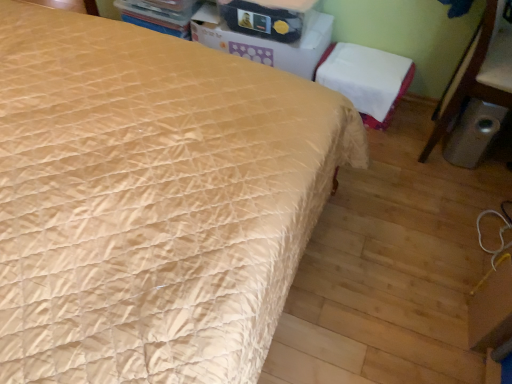
This screenshot has width=512, height=384. I want to click on free space on the front side of metallic trash can at lower right, so click(x=441, y=222).